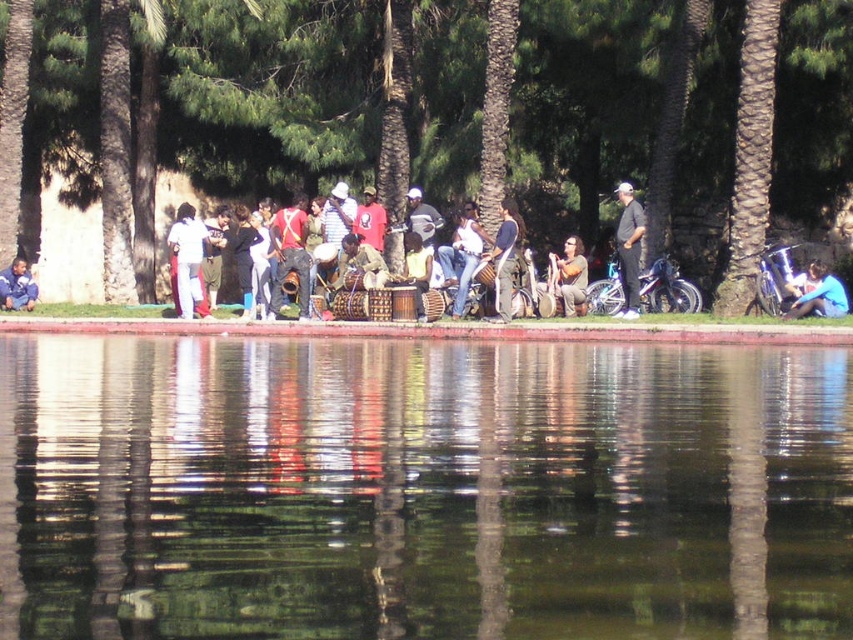
You are a photographer standing at the edge of the water. You want to take a photo that includes both the brown textured tree at center and the brushed metal jacket at center. Given that your camera can capture a maximum distance of 10 meters between the nearest and farthest objects in focus, will both objects be in focus in the same shot?

The brown textured tree at center is 9.68 meters from the brushed metal jacket at center. Since the distance between them is less than the camera maximum focus range of 10 meters, both objects will be in focus in the same shot.

You are standing on the dock and want to give a gift to both the person wearing the white cotton shirt at center and the person wearing the dark blue fabric shirt at center. If you first approach the person closer to your left side, which shirt will you give the gift to first?

The white cotton shirt at center is to the left of dark blue fabric shirt at center, so you will give the gift to the person wearing the white cotton shirt at center first.